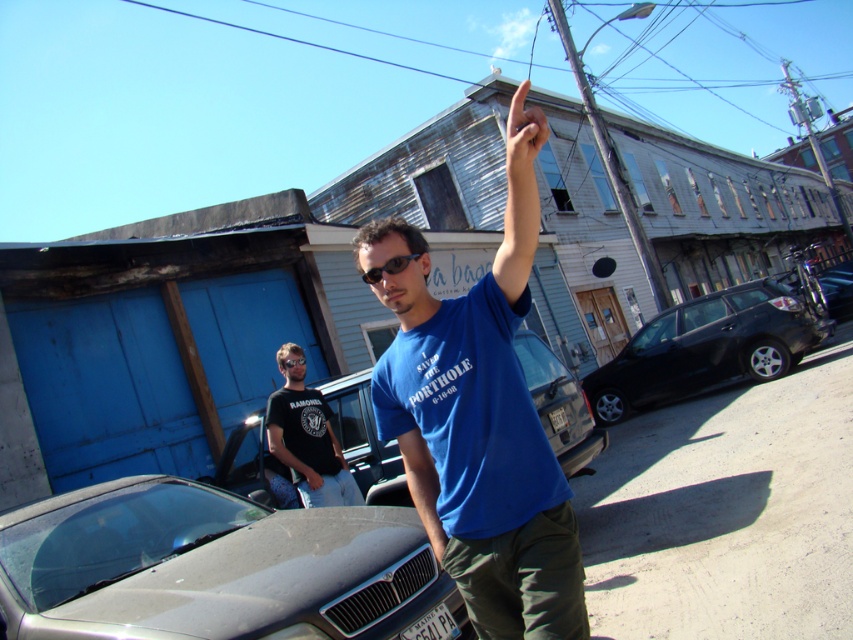
Which of these two, metallic blue sedan at center or black rubber goggles at center, stands taller?

Standing taller between the two is metallic blue sedan at center.

Who is higher up, metallic blue sedan at center or black rubber goggles at center?

black rubber goggles at center

Locate an element on the screen. This screenshot has height=640, width=853. metallic blue sedan at center is located at coordinates (560, 404).

Locate an element on the screen. This screenshot has width=853, height=640. metallic blue sedan at center is located at coordinates (560, 404).

Is blue cotton shirt at center closer to the viewer compared to black rubber goggles at center?

Yes.

The image size is (853, 640). What do you see at coordinates (477, 433) in the screenshot?
I see `blue cotton shirt at center` at bounding box center [477, 433].

Find the location of `blue cotton shirt at center`. blue cotton shirt at center is located at coordinates (477, 433).

Does silver metallic car at center appear under black rubber goggles at center?

Indeed, silver metallic car at center is positioned under black rubber goggles at center.

You are a GUI agent. You are given a task and a screenshot of the screen. Output one action in this format:
    pyautogui.click(x=<x>, y=<y>)
    Task: Click on the silver metallic car at center
    Image resolution: width=853 pixels, height=640 pixels.
    Given the screenshot: What is the action you would take?
    pyautogui.click(x=216, y=566)

This screenshot has height=640, width=853. What are the coordinates of `silver metallic car at center` in the screenshot? It's located at pos(216,566).